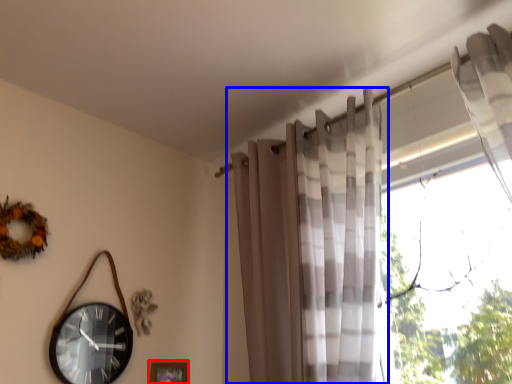
Question: Among these objects, which one is nearest to the camera, picture frame (highlighted by a red box) or curtain (highlighted by a blue box)?

Choices:
 (A) picture frame
 (B) curtain

Answer: (B)